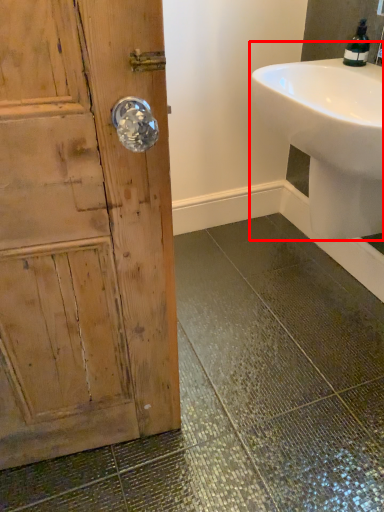
Question: Where is sink (annotated by the red box) located in relation to soap dispenser in the image?

Choices:
 (A) right
 (B) left

Answer: (B)